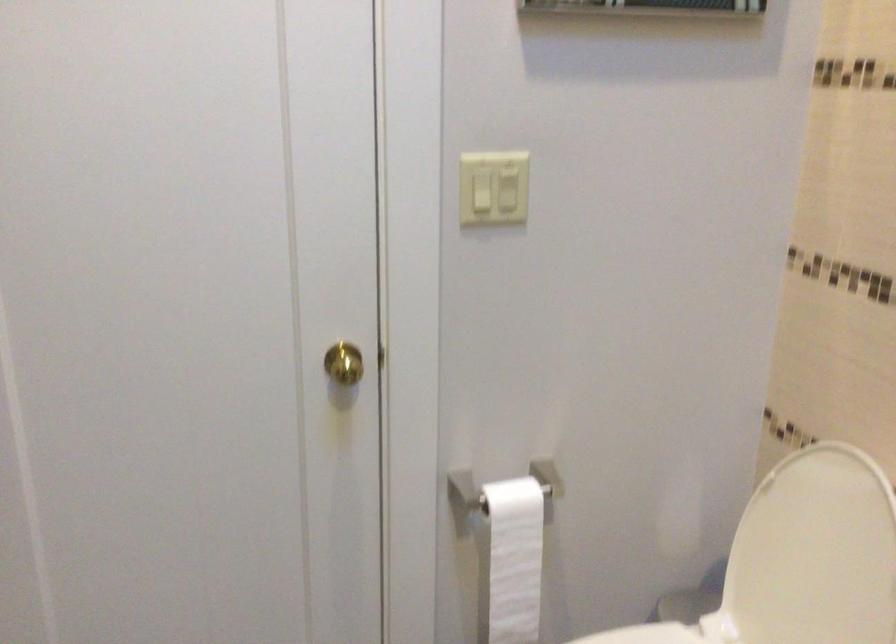
This screenshot has height=644, width=896. I want to click on toilet lid, so click(x=813, y=554).